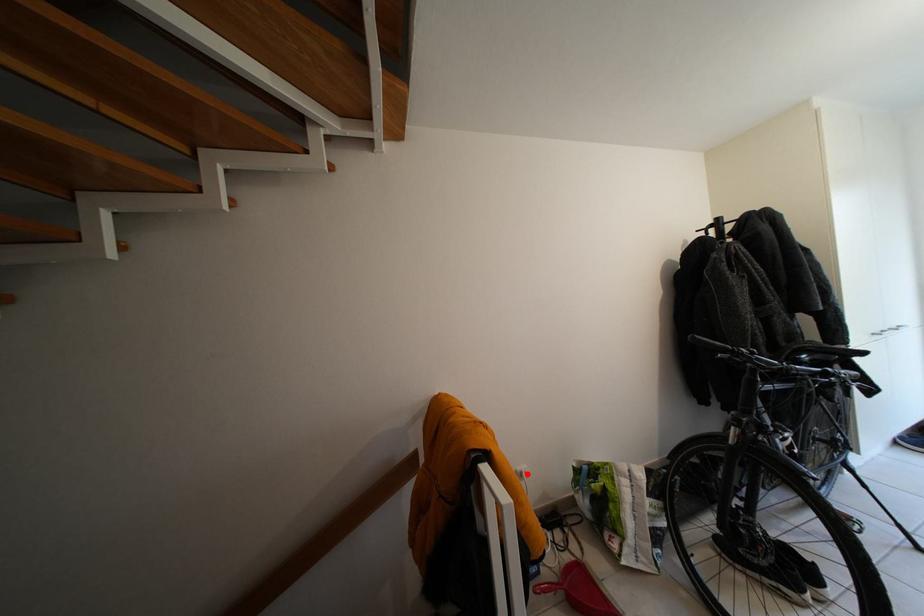
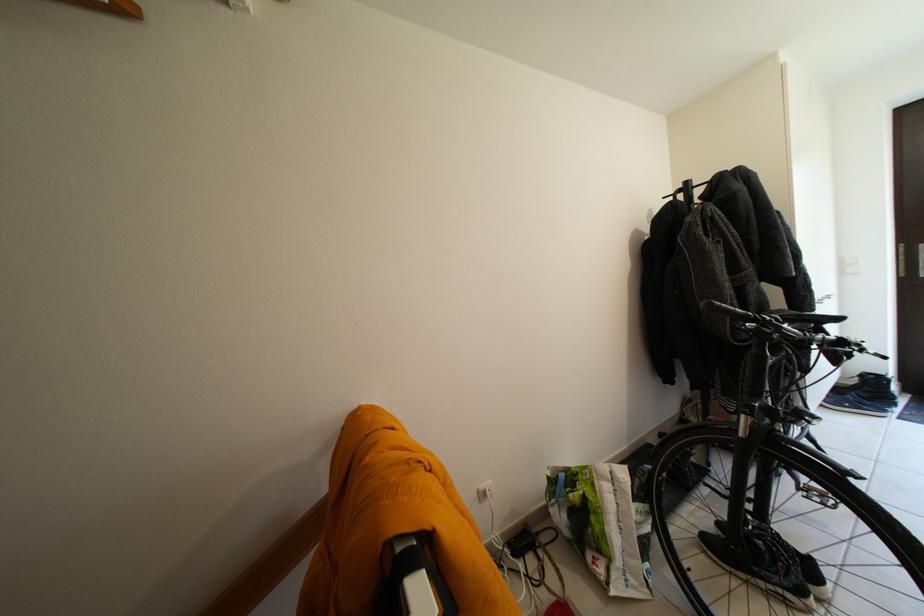
Question: I am providing you with two images of the same scene from different viewpoints. Image1 has a red point marked. In image2, the corresponding 3D location appears at what relative position? Reply with the corresponding letter.

Choices:
 (A) Closer
 (B) Farther

Answer: (A)